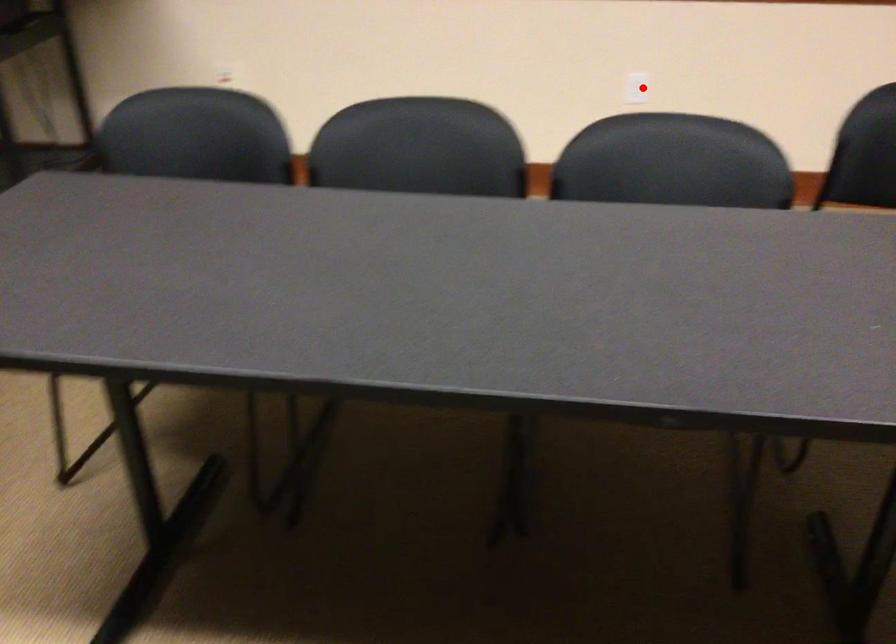
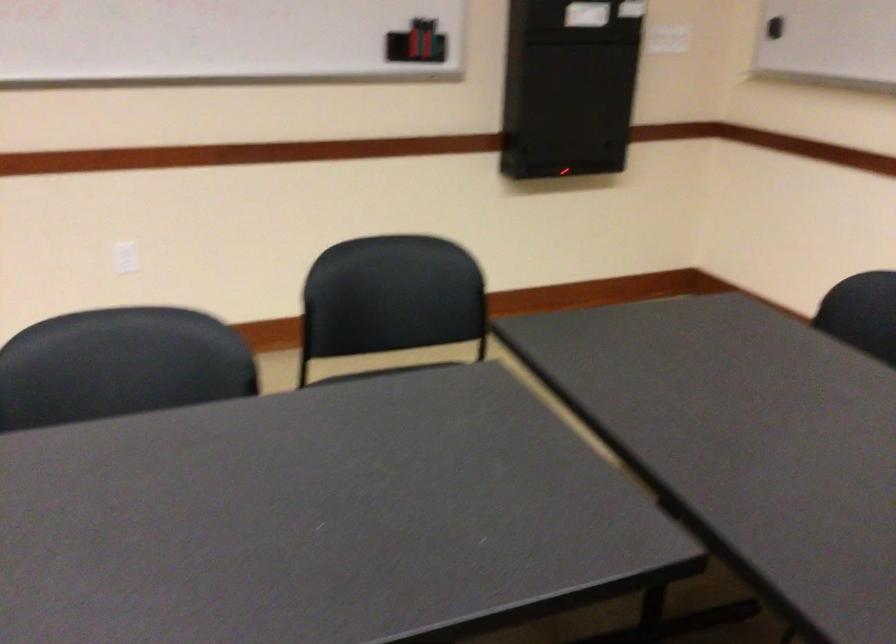
Locate, in the second image, the point that corresponds to the highlighted location in the first image.

(125, 257)